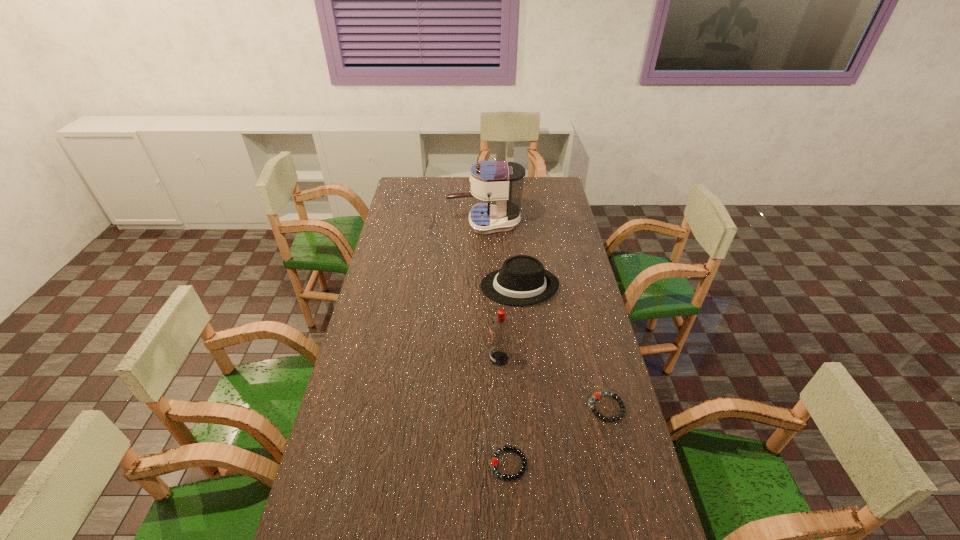
This screenshot has width=960, height=540. I want to click on free region located 0.290m on the right of the nearer bracelet, so click(x=634, y=464).

At what (x,y) coordinates should I click in order to perform the action: click on fedora located at the right edge. Please return your answer as a coordinate pair (x, y). The height and width of the screenshot is (540, 960). Looking at the image, I should click on (522, 280).

The image size is (960, 540). What are the coordinates of `bracelet positioned at the right edge` in the screenshot? It's located at (597, 395).

Identify the location of vacant region at the far edge of the desktop. This screenshot has height=540, width=960. (454, 186).

In the image, there is a desktop. Find the location of `vacant area at the left edge`. vacant area at the left edge is located at coordinates (306, 535).

Find the location of a particular element. vacant space at the right edge is located at coordinates point(586,276).

Locate an element on the screen. vacant space at the far right corner of the desktop is located at coordinates (540, 183).

This screenshot has width=960, height=540. What are the coordinates of `empty space that is in between the left bracelet and the third shortest object` in the screenshot? It's located at (515, 375).

Find the location of a particular element. This screenshot has height=540, width=960. blank region between the third shortest object and the nearest object is located at coordinates (515, 375).

The height and width of the screenshot is (540, 960). Find the location of `vacant region between the nearer bracelet and the vodka`. vacant region between the nearer bracelet and the vodka is located at coordinates (504, 411).